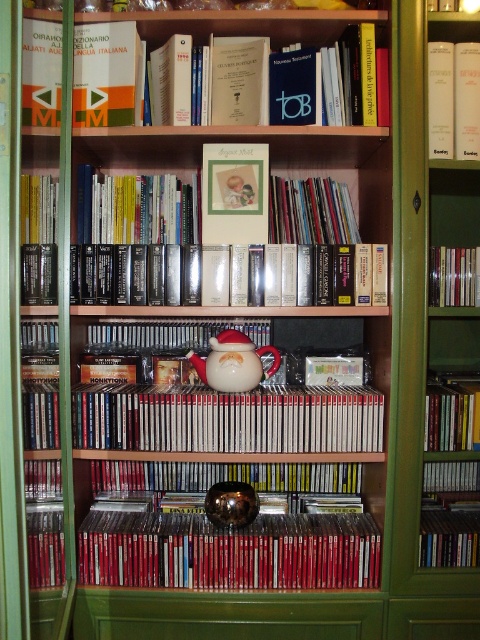
Can you confirm if hardcover book at upper center is positioned to the right of hardcover book at upper right?

In fact, hardcover book at upper center is to the left of hardcover book at upper right.

I want to click on hardcover book at upper center, so click(107, 76).

Where is `hardcover book at upper center`? The image size is (480, 640). hardcover book at upper center is located at coordinates (107, 76).

Based on the photo, is matte white picture frame at upper center to the left of metallic silver cd at right from the viewer's perspective?

Indeed, matte white picture frame at upper center is positioned on the left side of metallic silver cd at right.

Does matte white picture frame at upper center appear under metallic silver cd at right?

Actually, matte white picture frame at upper center is above metallic silver cd at right.

At what (x,y) coordinates should I click in order to perform the action: click on matte white picture frame at upper center. Please return your answer as a coordinate pair (x, y). This screenshot has width=480, height=640. Looking at the image, I should click on coord(220,241).

Between matte black book at center and hardcover book at upper right, which one has more height?

With more height is hardcover book at upper right.

Can you confirm if matte black book at center is wider than hardcover book at upper right?

Indeed, matte black book at center has a greater width compared to hardcover book at upper right.

Where is `matte black book at center`? The image size is (480, 640). matte black book at center is located at coordinates (450, 515).